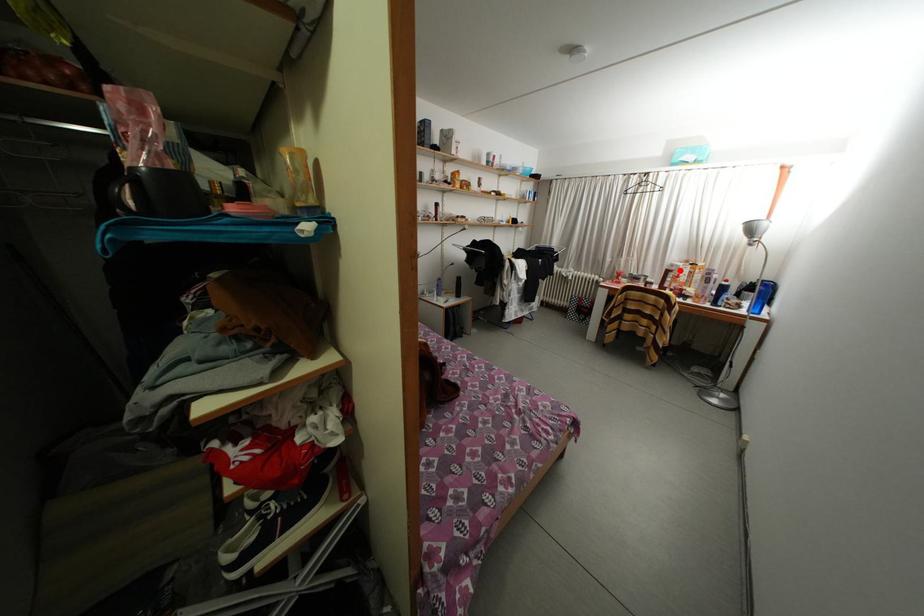
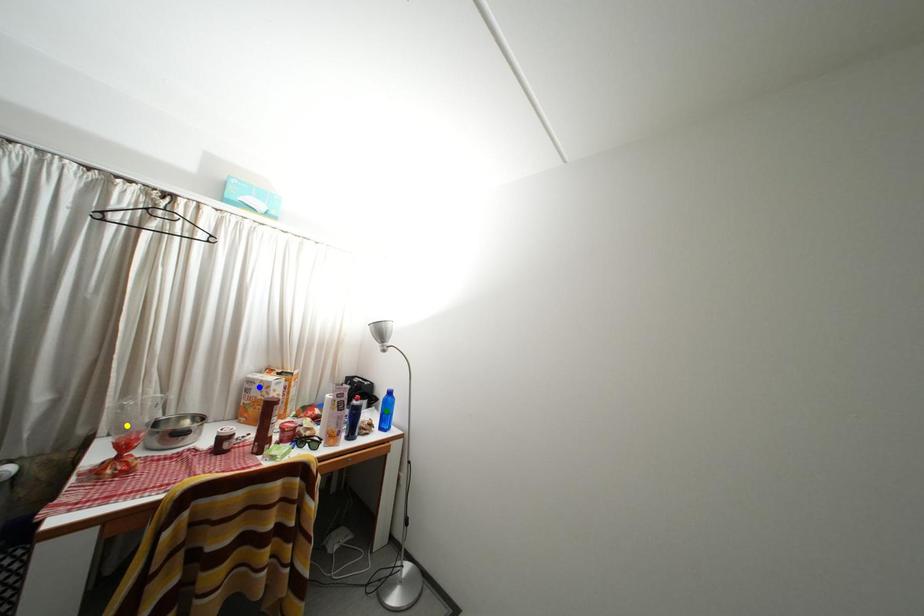
Question: I am providing you with two images of the same scene from different viewpoints. A red point is marked on the first image. You are given multiple points on the second image. Which spot in image 2 lines up with the point in image 1?

Choices:
 (A) yellow point
 (B) green point
 (C) blue point

Answer: (C)